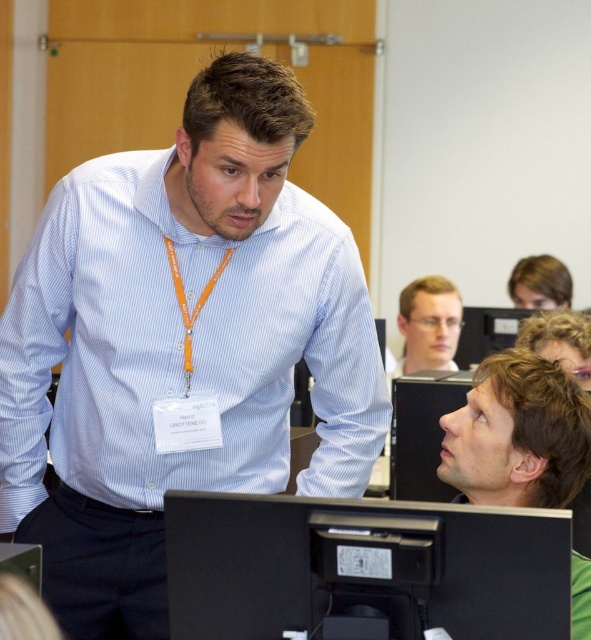
Question: Which of the following is the closest to the observer?

Choices:
 (A) (449, 344)
 (B) (189, 272)
 (C) (440, 524)

Answer: (C)

Question: Observing the image, what is the correct spatial positioning of dark brown hair at lower right in reference to clear plastic glasses at center?

Choices:
 (A) right
 (B) left

Answer: (B)

Question: Is blue striped shirt at center thinner than black plastic monitor at lower center?

Choices:
 (A) yes
 (B) no

Answer: (B)

Question: Which object is farther from the camera taking this photo?

Choices:
 (A) black plastic monitor at lower center
 (B) black plastic monitor at center
 (C) blue striped shirt at center

Answer: (A)

Question: Is the position of black plastic monitor at lower center less distant than that of clear plastic glasses at center?

Choices:
 (A) yes
 (B) no

Answer: (A)

Question: Among these points, which one is farthest from the camera?

Choices:
 (A) (405, 316)
 (B) (540, 380)
 (C) (392, 403)

Answer: (A)